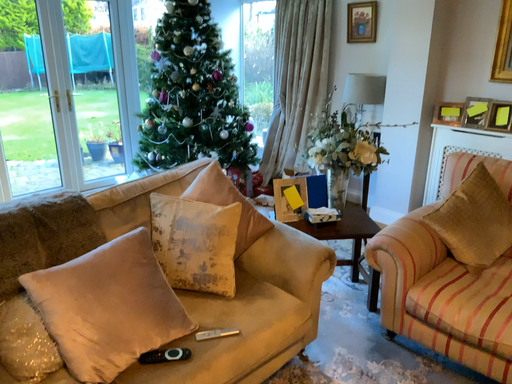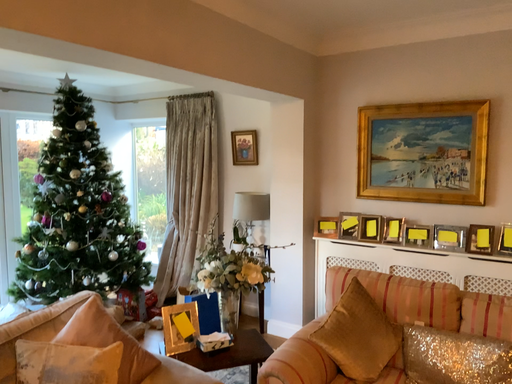
Question: How did the camera likely rotate when shooting the video?

Choices:
 (A) rotated right
 (B) rotated left

Answer: (A)